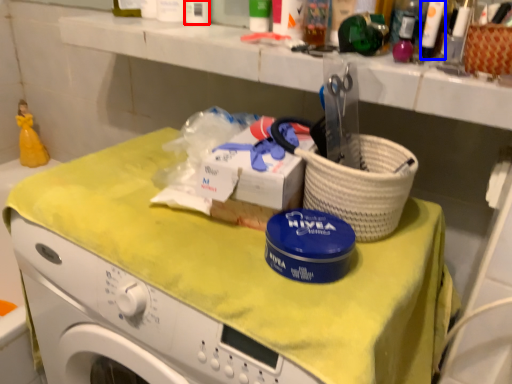
Question: Which point is closer to the camera, toiletry (highlighted by a red box) or toiletry (highlighted by a blue box)?

Choices:
 (A) toiletry
 (B) toiletry

Answer: (B)